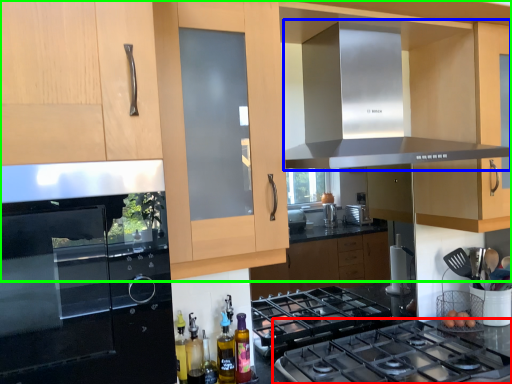
Question: Considering the real-world distances, which object is farthest from gas stove (highlighted by a red box)? exhaust hood (highlighted by a blue box) or cabinetry (highlighted by a green box)?

Choices:
 (A) exhaust hood
 (B) cabinetry

Answer: (A)